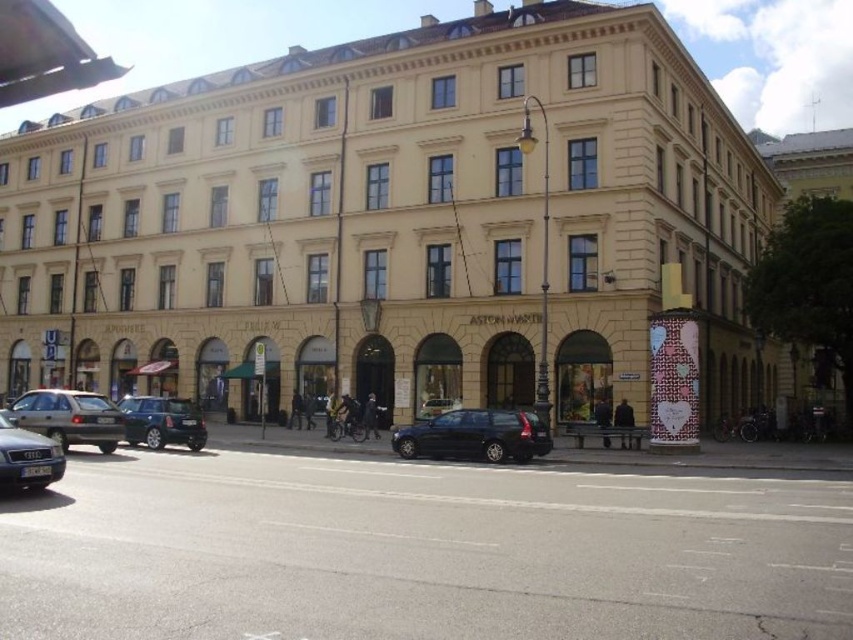
You are a delivery person trying to park your delivery van, which is 2 meters wide. You see the beige stone building at center and the shiny black station wagon at center. Can you park your van between them?

The beige stone building at center might be wider than the shiny black station wagon at center, so there may be enough space to park the van between them. However, since the exact width difference isn not specified, it is uncertain.

You are a delivery person trying to park your van in the space between the shiny black station wagon at center and the matte black car at lower left. Can you safely park there if your van is 5 meters long?

The shiny black station wagon at center is positioned under the matte black car at lower left, which means they are stacked vertically. Since the van is 5 meters long, it would require a horizontal space, but the available space between them is likely narrower than 5 meters. Therefore, the van cannot safely park there.

You are a pedestrian standing on the sidewalk in front of the building. You see the shiny black station wagon at center and the matte black car at lower left. Which vehicle is positioned farther to the right?

The shiny black station wagon at center is positioned farther to the right compared to the matte black car at lower left.